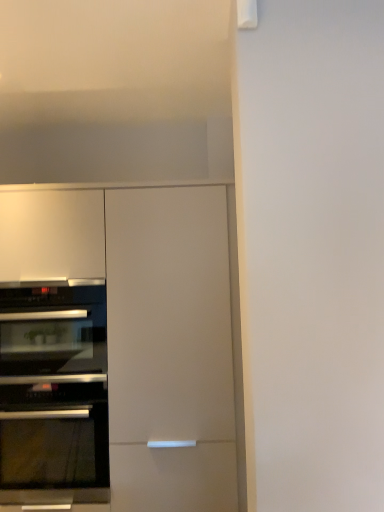
Question: Is black glass oven at left, placed as the first oven when sorted from bottom to top, placed right next to black glass oven at left, the first oven from the top?

Choices:
 (A) yes
 (B) no

Answer: (A)

Question: From the image's perspective, is black glass oven at left, which appears as the second oven when viewed from the top, beneath black glass oven at left, the first oven from the top?

Choices:
 (A) no
 (B) yes

Answer: (B)

Question: Is black glass oven at left, positioned as the second oven in bottom-to-top order, at the back of black glass oven at left, placed as the first oven when sorted from bottom to top?

Choices:
 (A) yes
 (B) no

Answer: (B)

Question: Is black glass oven at left, which appears as the second oven when viewed from the top, facing towards black glass oven at left, the first oven from the top?

Choices:
 (A) no
 (B) yes

Answer: (A)

Question: Can you confirm if black glass oven at left, placed as the first oven when sorted from bottom to top, is taller than black glass oven at left, positioned as the second oven in bottom-to-top order?

Choices:
 (A) yes
 (B) no

Answer: (A)

Question: In terms of height, does matte white cabinet at left look taller or shorter compared to black glass oven at left, placed as the first oven when sorted from bottom to top?

Choices:
 (A) tall
 (B) short

Answer: (A)

Question: Is point (208, 459) closer or farther from the camera than point (44, 423)?

Choices:
 (A) farther
 (B) closer

Answer: (B)

Question: Is matte white cabinet at left inside or outside of black glass oven at left, placed as the first oven when sorted from bottom to top?

Choices:
 (A) inside
 (B) outside

Answer: (B)

Question: Is matte white cabinet at left in front of or behind black glass oven at left, which appears as the second oven when viewed from the top, in the image?

Choices:
 (A) behind
 (B) front

Answer: (A)

Question: Is black glass oven at left, the first oven from the top, bigger or smaller than matte white cabinet at left?

Choices:
 (A) small
 (B) big

Answer: (A)

Question: From the image's perspective, relative to matte white cabinet at left, is black glass oven at left, positioned as the second oven in bottom-to-top order, above or below?

Choices:
 (A) below
 (B) above

Answer: (B)

Question: Is black glass oven at left, positioned as the second oven in bottom-to-top order, in front of or behind matte white cabinet at left in the image?

Choices:
 (A) front
 (B) behind

Answer: (B)

Question: Considering the positions of black glass oven at left, positioned as the second oven in bottom-to-top order, and matte white cabinet at left in the image, is black glass oven at left, positioned as the second oven in bottom-to-top order, wider or thinner than matte white cabinet at left?

Choices:
 (A) wide
 (B) thin

Answer: (B)

Question: Is black glass oven at left, which appears as the second oven when viewed from the top, situated inside black glass oven at left, the first oven from the top, or outside?

Choices:
 (A) inside
 (B) outside

Answer: (B)

Question: From the image's perspective, is black glass oven at left, placed as the first oven when sorted from bottom to top, located above or below black glass oven at left, the first oven from the top?

Choices:
 (A) below
 (B) above

Answer: (A)